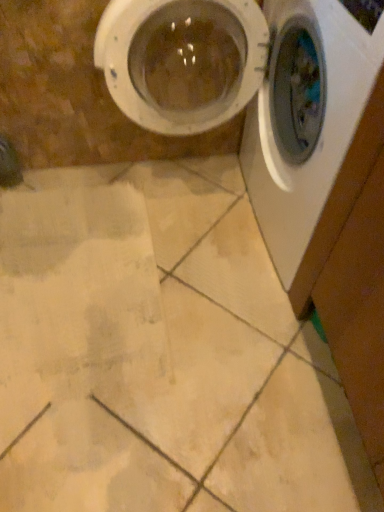
Question: Can we say white glossy washing machine at right, which ranks as the 2th washing machine in left-to-right order, lies outside white plastic washing machine at upper right, which ranks as the first washing machine in left-to-right order?

Choices:
 (A) no
 (B) yes

Answer: (B)

Question: Does white glossy washing machine at right, which ranks as the 2th washing machine in left-to-right order, have a smaller size compared to white plastic washing machine at upper right, which ranks as the first washing machine in left-to-right order?

Choices:
 (A) no
 (B) yes

Answer: (A)

Question: Does white glossy washing machine at right, which ranks as the 2th washing machine in left-to-right order, come behind white plastic washing machine at upper right, which ranks as the first washing machine in left-to-right order?

Choices:
 (A) yes
 (B) no

Answer: (B)

Question: Does white glossy washing machine at right, which is the first washing machine from right to left, have a greater height compared to white plastic washing machine at upper right, the 2th washing machine when ordered from right to left?

Choices:
 (A) yes
 (B) no

Answer: (B)

Question: From a real-world perspective, is white glossy washing machine at right, which is the first washing machine from right to left, below white plastic washing machine at upper right, which ranks as the first washing machine in left-to-right order?

Choices:
 (A) yes
 (B) no

Answer: (A)

Question: Is white glossy washing machine at right, which is the first washing machine from right to left, in contact with white plastic washing machine at upper right, the 2th washing machine when ordered from right to left?

Choices:
 (A) no
 (B) yes

Answer: (B)

Question: Is white plastic washing machine at upper right, which ranks as the first washing machine in left-to-right order, far away from white glossy washing machine at right, which is the first washing machine from right to left?

Choices:
 (A) no
 (B) yes

Answer: (A)

Question: Can you confirm if white plastic washing machine at upper right, the 2th washing machine when ordered from right to left, is positioned to the left of white glossy washing machine at right, which ranks as the 2th washing machine in left-to-right order?

Choices:
 (A) yes
 (B) no

Answer: (A)

Question: Considering the relative sizes of white plastic washing machine at upper right, which ranks as the first washing machine in left-to-right order, and white glossy washing machine at right, which is the first washing machine from right to left, in the image provided, is white plastic washing machine at upper right, which ranks as the first washing machine in left-to-right order, shorter than white glossy washing machine at right, which is the first washing machine from right to left,?

Choices:
 (A) no
 (B) yes

Answer: (A)

Question: Is white plastic washing machine at upper right, the 2th washing machine when ordered from right to left, smaller than white glossy washing machine at right, which ranks as the 2th washing machine in left-to-right order?

Choices:
 (A) no
 (B) yes

Answer: (B)

Question: Can you confirm if white plastic washing machine at upper right, which ranks as the first washing machine in left-to-right order, is taller than white glossy washing machine at right, which ranks as the 2th washing machine in left-to-right order?

Choices:
 (A) yes
 (B) no

Answer: (A)

Question: Does white plastic washing machine at upper right, which ranks as the first washing machine in left-to-right order, have a lesser width compared to white glossy washing machine at right, which ranks as the 2th washing machine in left-to-right order?

Choices:
 (A) yes
 (B) no

Answer: (B)

Question: In terms of size, does white glossy washing machine at right, which is the first washing machine from right to left, appear bigger or smaller than white plastic washing machine at upper right, the 2th washing machine when ordered from right to left?

Choices:
 (A) big
 (B) small

Answer: (A)